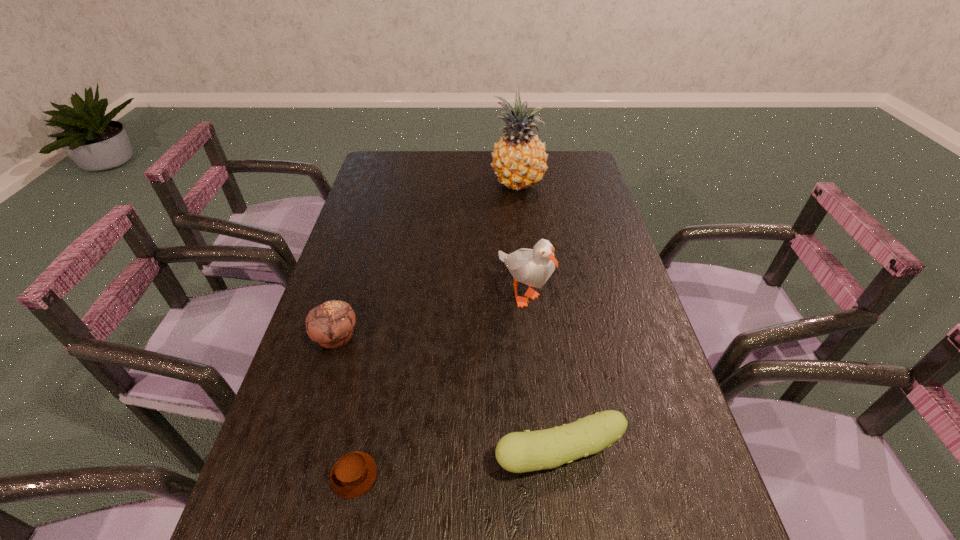
Identify the location of vacant point located between the right muffin and the gull. (439, 383).

Locate an element on the screen. This screenshot has width=960, height=540. unoccupied area between the farther muffin and the gull is located at coordinates (430, 314).

The width and height of the screenshot is (960, 540). Identify the location of free space between the cucumber and the taller muffin. (447, 396).

You are a GUI agent. You are given a task and a screenshot of the screen. Output one action in this format:
    pyautogui.click(x=<x>, y=<y>)
    Task: Click on the free area in between the cucumber and the pineapple
    
    Given the screenshot: What is the action you would take?
    pyautogui.click(x=539, y=319)

Locate an element on the screen. This screenshot has width=960, height=540. empty space between the cucumber and the left muffin is located at coordinates (447, 396).

Find the location of a particular element. The image size is (960, 540). vacant point located between the shortest object and the leftmost object is located at coordinates (345, 406).

The image size is (960, 540). Identify the location of free space that is in between the fourth object from right to left and the left muffin. (345, 406).

The image size is (960, 540). What are the coordinates of `free space between the farther muffin and the fourth shortest object` in the screenshot? It's located at (430, 314).

Identify the location of free space between the shortest object and the cucumber. Image resolution: width=960 pixels, height=540 pixels. point(457,465).

I want to click on object that is the fourth closest to the gull, so click(x=353, y=474).